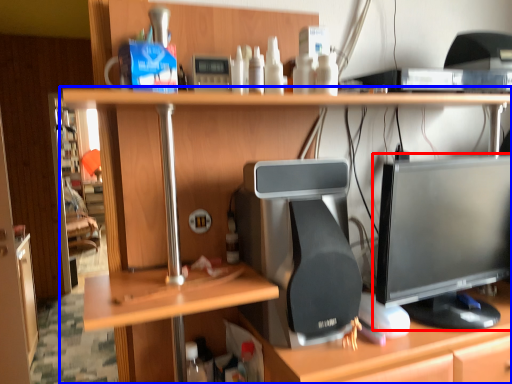
Question: Which of the following is the farthest to the observer, computer monitor (highlighted by a red box) or desk (highlighted by a blue box)?

Choices:
 (A) computer monitor
 (B) desk

Answer: (A)